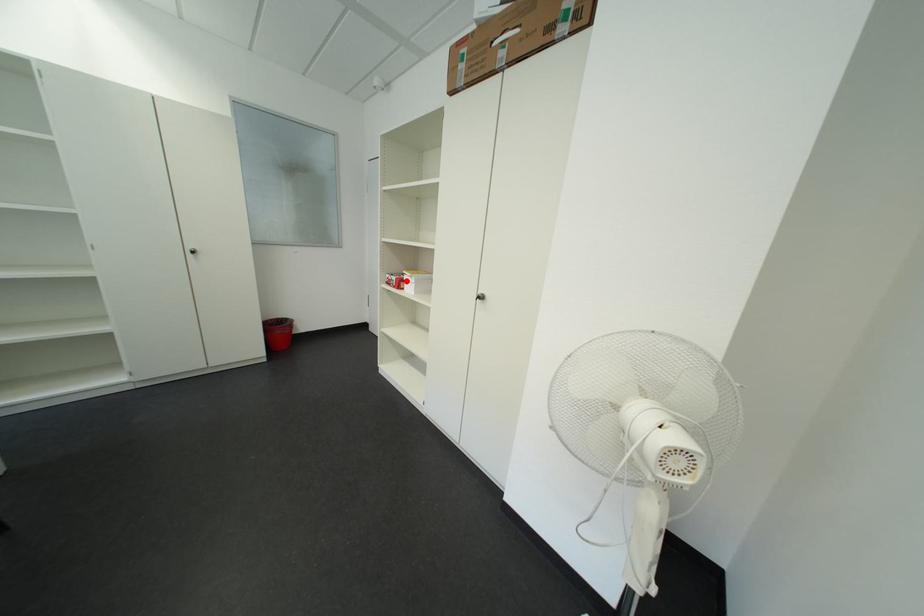
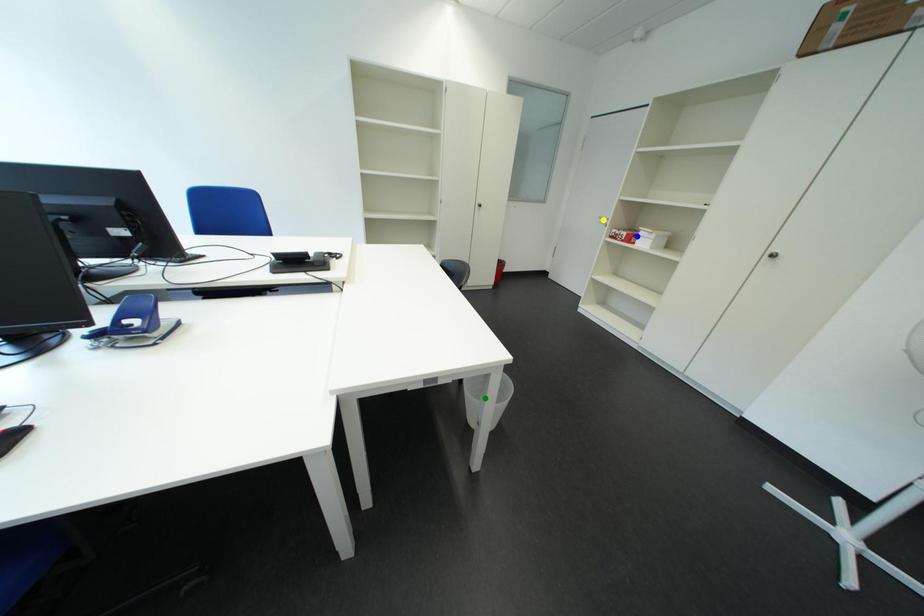
Question: I am providing you with two images of the same scene from different viewpoints. A red point is marked on the first image. You are given multiple points on the second image. Which point in image 2 is actually the same real-world point as the red point in image 1?

Choices:
 (A) yellow point
 (B) blue point
 (C) green point

Answer: (B)